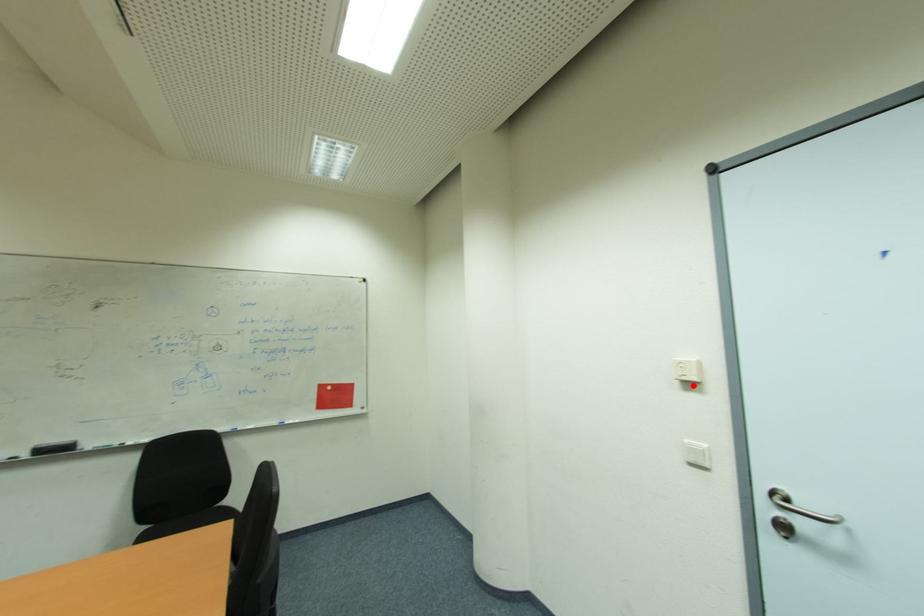
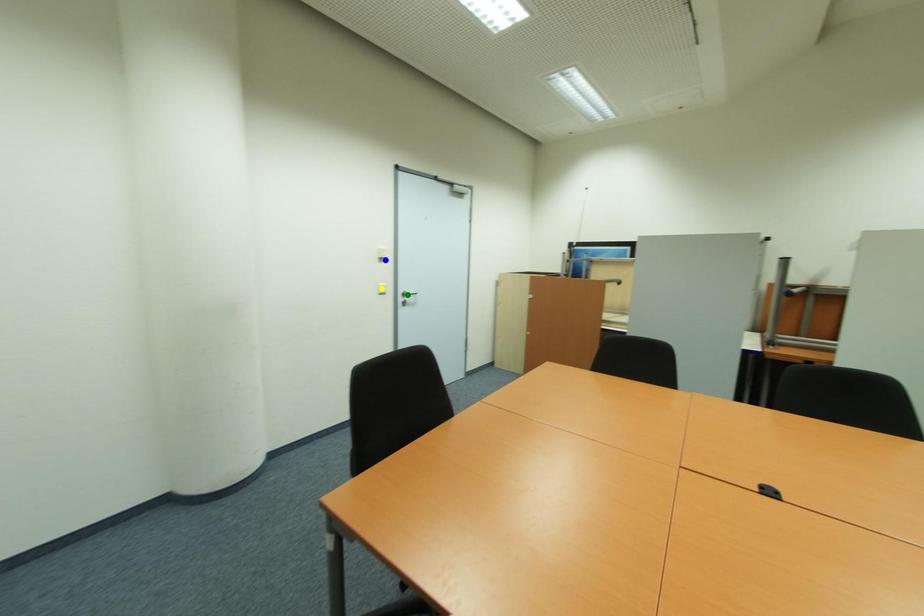
Question: I am providing you with two images of the same scene from different viewpoints. A red point is marked on the first image. You are given multiple points on the second image. Which point in image 2 represents the same 3d spot as the red point in image 1?

Choices:
 (A) blue point
 (B) green point
 (C) yellow point

Answer: (A)